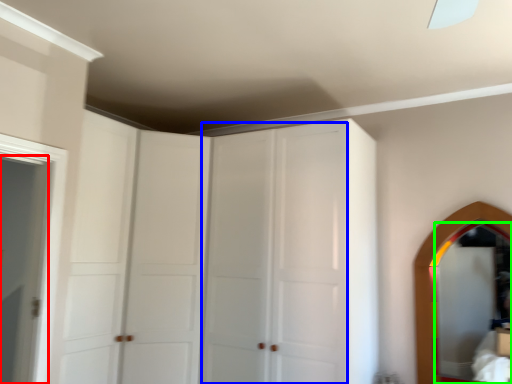
Question: Considering the real-world distances, which object is closest to door (highlighted by a red box)? glass door (highlighted by a blue box) or mirror (highlighted by a green box).

Choices:
 (A) glass door
 (B) mirror

Answer: (A)